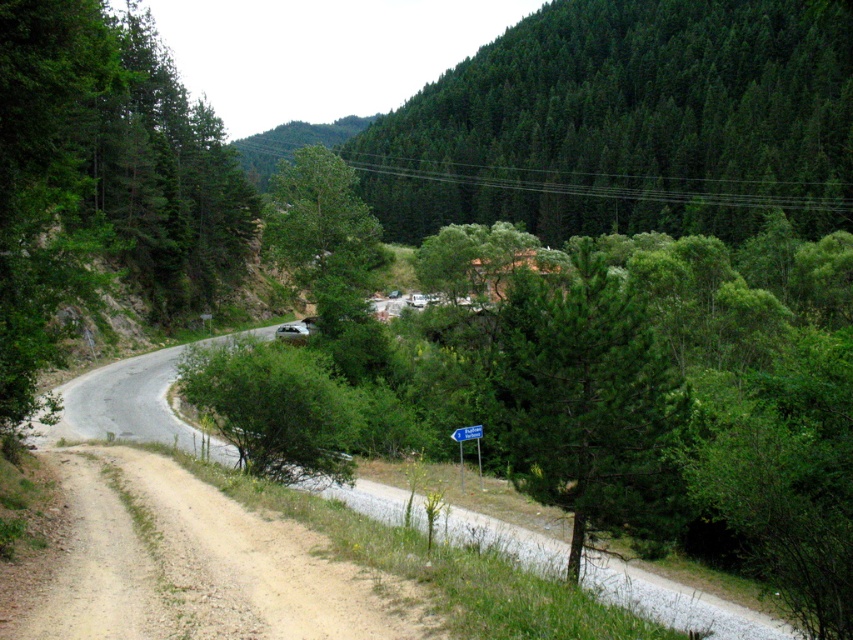
You are a hiker standing at the starting point of the brown gravel dirt track at lower left. You want to walk to the green leafy bush at center. Which direction should you head to reach the bush?

The brown gravel dirt track at lower left is much taller than the green leafy bush at center, so you should head downhill to reach the green leafy bush at center.